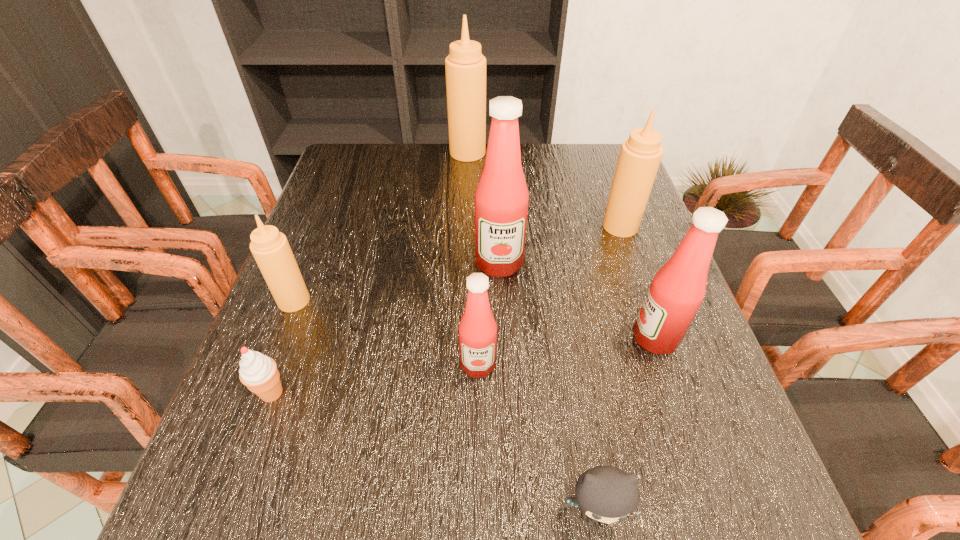
Locate an element on the screen. the farthest tan condiment is located at coordinates (465, 66).

Where is `the biggest tan condiment`? This screenshot has width=960, height=540. the biggest tan condiment is located at coordinates (465, 66).

Identify the location of the biggest red condiment. (501, 199).

The image size is (960, 540). What are the coordinates of `the fourth nearest condiment` in the screenshot? It's located at 501,199.

Identify the location of the second farthest object. This screenshot has height=540, width=960. (640, 155).

The width and height of the screenshot is (960, 540). Find the location of `the rightmost tan condiment`. the rightmost tan condiment is located at coordinates (x=640, y=155).

This screenshot has height=540, width=960. I want to click on the rightmost red condiment, so click(678, 288).

Identify the location of the nearest tan condiment. Image resolution: width=960 pixels, height=540 pixels. point(270,248).

You are a GUI agent. You are given a task and a screenshot of the screen. Output one action in this format:
    pyautogui.click(x=<x>, y=<y>)
    Task: Click on the leftmost condiment
    This screenshot has width=960, height=540.
    Given the screenshot: What is the action you would take?
    pyautogui.click(x=270, y=248)

Locate an element on the screen. The image size is (960, 540). the smallest red condiment is located at coordinates (477, 330).